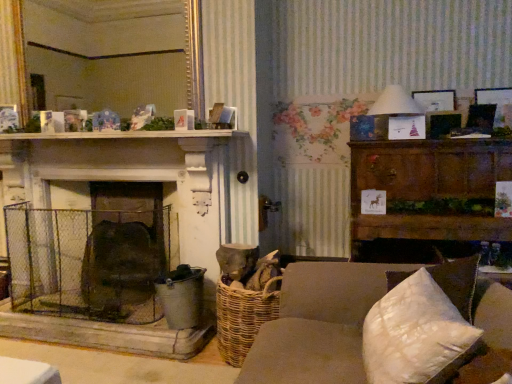
Question: Can you confirm if dark brown wood cabinet at right is positioned to the left of gold-framed mirror at upper center?

Choices:
 (A) no
 (B) yes

Answer: (A)

Question: Is dark brown wood cabinet at right outside gold-framed mirror at upper center?

Choices:
 (A) yes
 (B) no

Answer: (A)

Question: Does dark brown wood cabinet at right have a greater width compared to gold-framed mirror at upper center?

Choices:
 (A) no
 (B) yes

Answer: (B)

Question: Does dark brown wood cabinet at right have a larger size compared to gold-framed mirror at upper center?

Choices:
 (A) no
 (B) yes

Answer: (B)

Question: From the image's perspective, is dark brown wood cabinet at right located beneath gold-framed mirror at upper center?

Choices:
 (A) yes
 (B) no

Answer: (A)

Question: Do you think brown fabric couch at center is within wooden picture frame at upper right, or outside of it?

Choices:
 (A) inside
 (B) outside

Answer: (B)

Question: From a real-world perspective, relative to wooden picture frame at upper right, is brown fabric couch at center vertically above or below?

Choices:
 (A) below
 (B) above

Answer: (A)

Question: Looking at the image, does brown fabric couch at center seem bigger or smaller compared to wooden picture frame at upper right?

Choices:
 (A) big
 (B) small

Answer: (A)

Question: In terms of width, does brown fabric couch at center look wider or thinner when compared to wooden picture frame at upper right?

Choices:
 (A) wide
 (B) thin

Answer: (A)

Question: Is brown fabric couch at center inside the boundaries of white quilted pillow at lower right, or outside?

Choices:
 (A) outside
 (B) inside

Answer: (A)

Question: Does point (315, 377) appear closer or farther from the camera than point (406, 372)?

Choices:
 (A) farther
 (B) closer

Answer: (A)

Question: From a real-world perspective, is brown fabric couch at center above or below white quilted pillow at lower right?

Choices:
 (A) below
 (B) above

Answer: (A)

Question: Based on their sizes in the image, would you say brown fabric couch at center is bigger or smaller than white quilted pillow at lower right?

Choices:
 (A) big
 (B) small

Answer: (A)

Question: Is point (433, 104) closer or farther from the camera than point (369, 380)?

Choices:
 (A) farther
 (B) closer

Answer: (A)

Question: Do you think wooden picture frame at upper right is within white quilted pillow at lower right, or outside of it?

Choices:
 (A) inside
 (B) outside

Answer: (B)